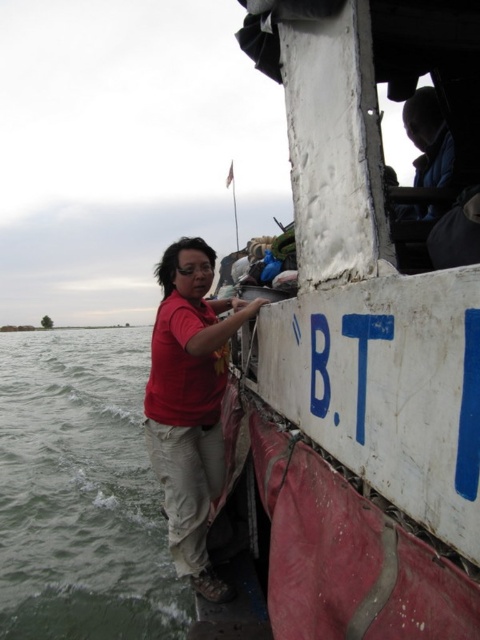
You are standing on the deck of the boat and want to move to the white matte boat at upper right. Which direction should you move relative to the matte red shirt at center?

You should move to the right of the matte red shirt at center to reach the white matte boat at upper right because the white matte boat at upper right is located to the right of the matte red shirt at center.

You are standing on the boat and want to reach the point marked as point (359,346). Which direction should you move relative to the boat?

The point (359,346) is on the white matte boat at upper right, so you should move towards the upper right direction relative to the boat.